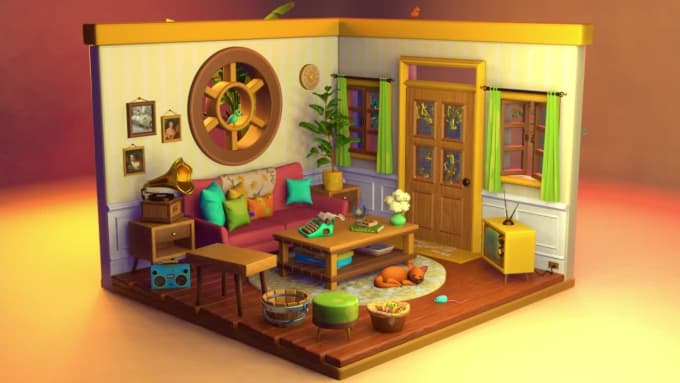
Locate an element on the screen. Image resolution: width=680 pixels, height=383 pixels. curtains is located at coordinates (553, 167).